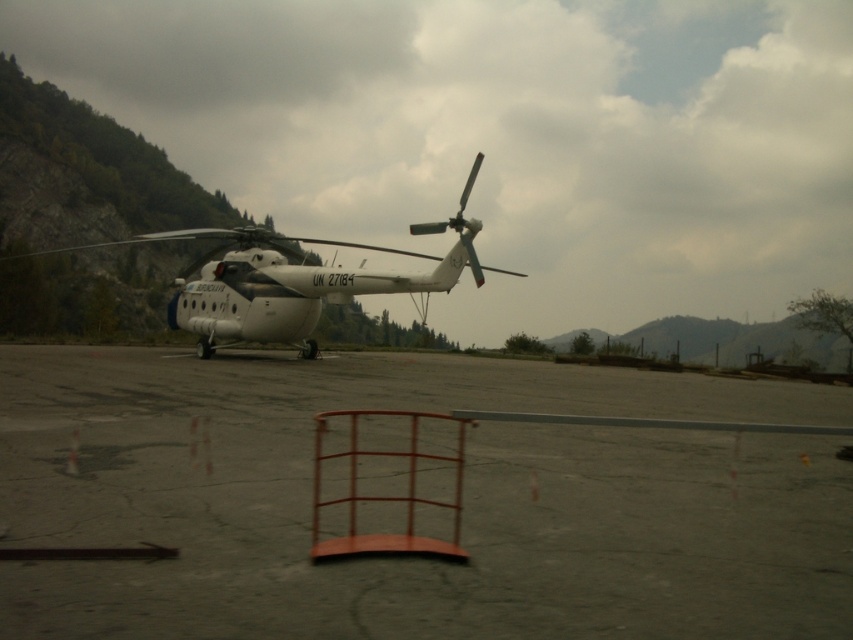
Question: Is gray concrete tarmac at center below white matte helicopter at center?

Choices:
 (A) yes
 (B) no

Answer: (A)

Question: Is gray concrete tarmac at center to the left of white matte helicopter at center from the viewer's perspective?

Choices:
 (A) yes
 (B) no

Answer: (B)

Question: Is gray concrete tarmac at center smaller than white matte helicopter at center?

Choices:
 (A) yes
 (B) no

Answer: (A)

Question: Which point is farther from the camera taking this photo?

Choices:
 (A) (228, 456)
 (B) (302, 264)

Answer: (B)

Question: Which of the following is the closest to the observer?

Choices:
 (A) (100, 465)
 (B) (277, 300)

Answer: (A)

Question: Among these points, which one is farthest from the camera?

Choices:
 (A) (186, 328)
 (B) (49, 586)

Answer: (A)